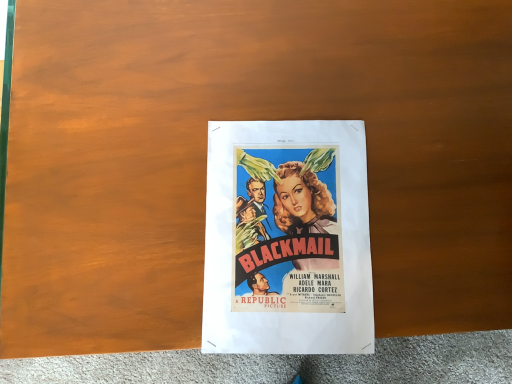
The image size is (512, 384). Find the location of `free space to the right of matte paper poster at center`. free space to the right of matte paper poster at center is located at coordinates (425, 190).